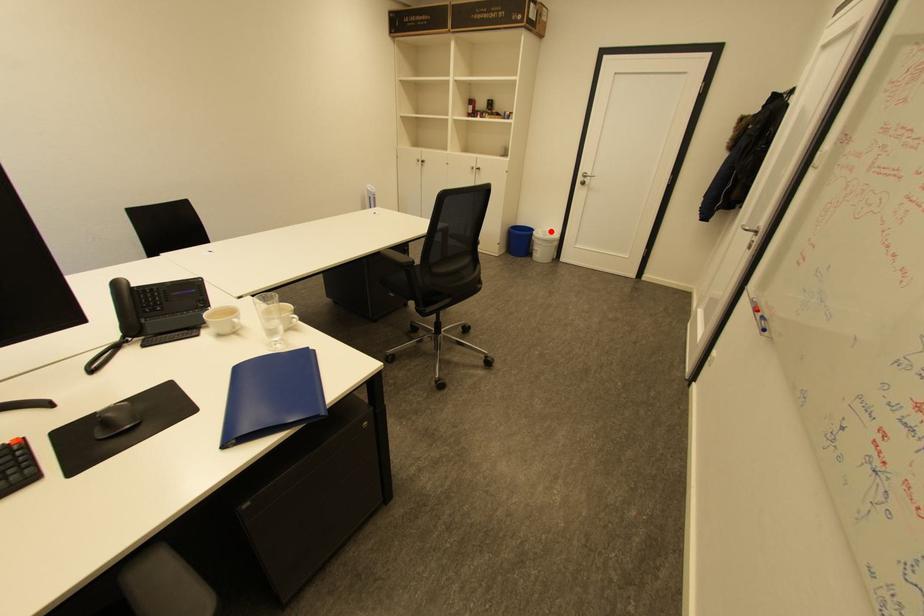
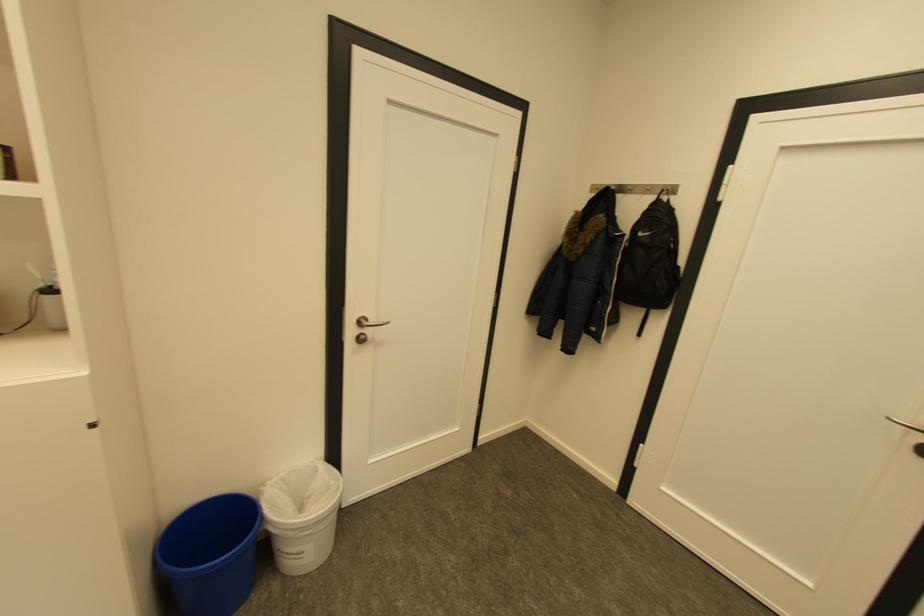
Question: I am providing you with two images of the same scene from different viewpoints. A red point is marked on the first image. At the location where the point appears in image 1, is it still visible in image 2?

Choices:
 (A) Yes
 (B) No

Answer: (A)